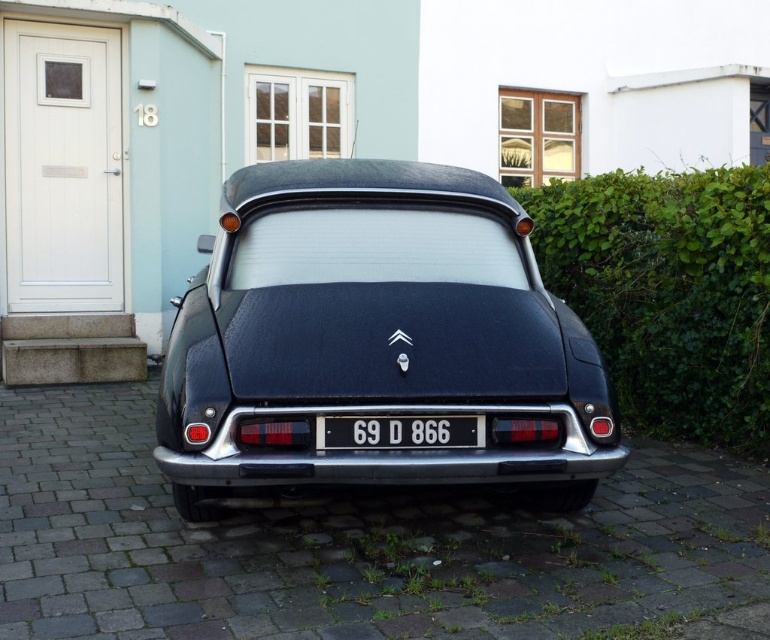
Question: Can you confirm if shiny black car at center is thinner than black plastic license plate at center?

Choices:
 (A) yes
 (B) no

Answer: (B)

Question: Which of these objects is positioned farthest from the shiny black car at center?

Choices:
 (A) black asphalt driveway at center
 (B) green leafy hedge at right
 (C) black plastic license plate at center

Answer: (B)

Question: Which point is farther from the camera taking this photo?

Choices:
 (A) (313, 452)
 (B) (675, 179)
 (C) (19, 413)

Answer: (B)

Question: Is black asphalt driveway at center below green leafy hedge at right?

Choices:
 (A) yes
 (B) no

Answer: (A)

Question: Is black asphalt driveway at center bigger than shiny black car at center?

Choices:
 (A) yes
 (B) no

Answer: (B)

Question: Which point is closer to the camera taking this photo?

Choices:
 (A) (678, 209)
 (B) (263, 330)

Answer: (B)